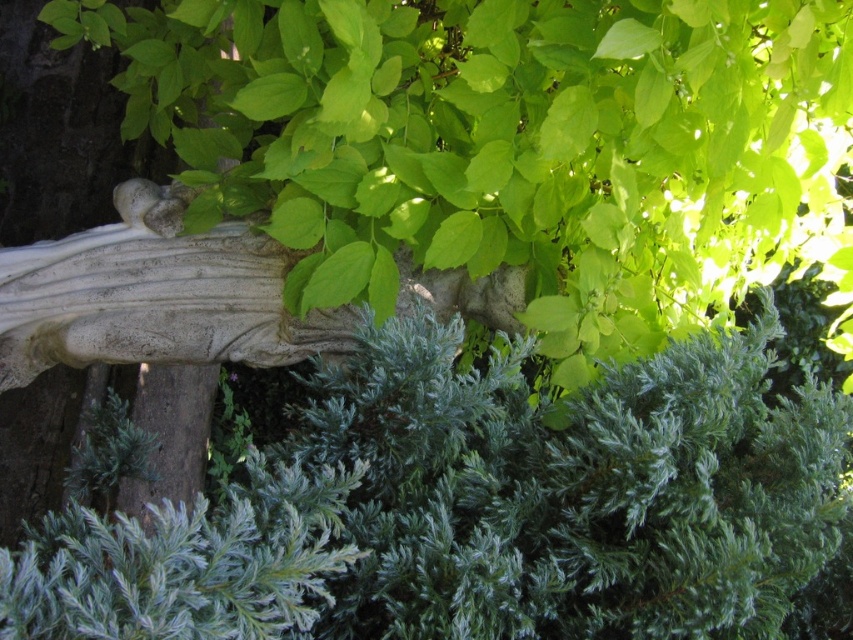
You are standing in the garden and want to place a small decorative statue exactly at point [476,508]. What object is currently located at that point?

The green textured bush at center is located at point [476,508].

You are a gardener trying to place a new decorative statue that is 12 inches wide between the green textured bush at center and the white stone sculpture at center. Can the statue fit in the space between them without overlapping either?

The space between the green textured bush at center and the white stone sculpture at center is 13.31 inches. Since the statue is 12 inches wide, it can fit as long as there is enough space on both sides. However, the exact positioning would require ensuring that the statue does not overlap either object. Since the available space is slightly larger than the statue, it should fit with a small gap on either side.

Consider the image. You are standing in the garden scene described. There are two points marked as point 1 at coordinates point (758, 376) and point 2 at coordinates point (73, 323). Which point is closer to you?

Point (758, 376) is in front of point (73, 323), so it is closer to you.